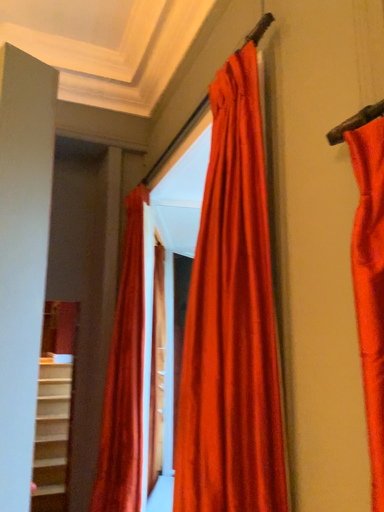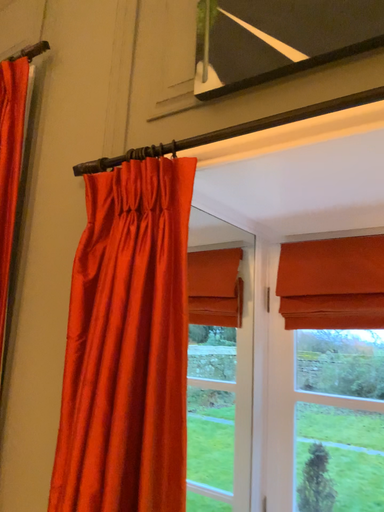
Question: Which way did the camera rotate in the video?

Choices:
 (A) rotated left
 (B) rotated right

Answer: (B)